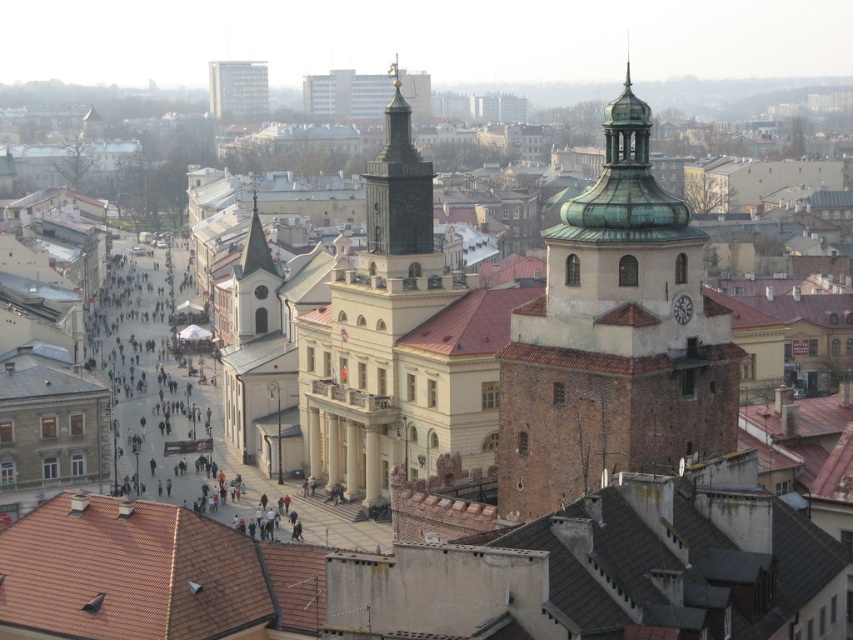
Question: Which object is the farthest from the dark brown stone tower at center?

Choices:
 (A) green copper dome at center right
 (B) matte gray building at upper center
 (C) dark gray stone clock tower at center
 (D) smooth white spire at upper left

Answer: (B)

Question: Is the position of matte gray building at upper center less distant than that of smooth white spire at upper left?

Choices:
 (A) no
 (B) yes

Answer: (A)

Question: Which object is closer to the camera taking this photo?

Choices:
 (A) dark gray stone clock tower at center
 (B) matte gray building at upper center

Answer: (A)

Question: Does dark brown stone tower at center have a smaller size compared to matte gray building at upper center?

Choices:
 (A) no
 (B) yes

Answer: (A)

Question: Estimate the real-world distances between objects in this image. Which object is farther from the green copper dome at center right?

Choices:
 (A) dark gray stone clock tower at center
 (B) dark brown stone tower at center
 (C) matte gray building at upper center
 (D) smooth white spire at upper left

Answer: (C)

Question: Does dark gray stone clock tower at center have a smaller size compared to matte gray building at upper center?

Choices:
 (A) no
 (B) yes

Answer: (A)